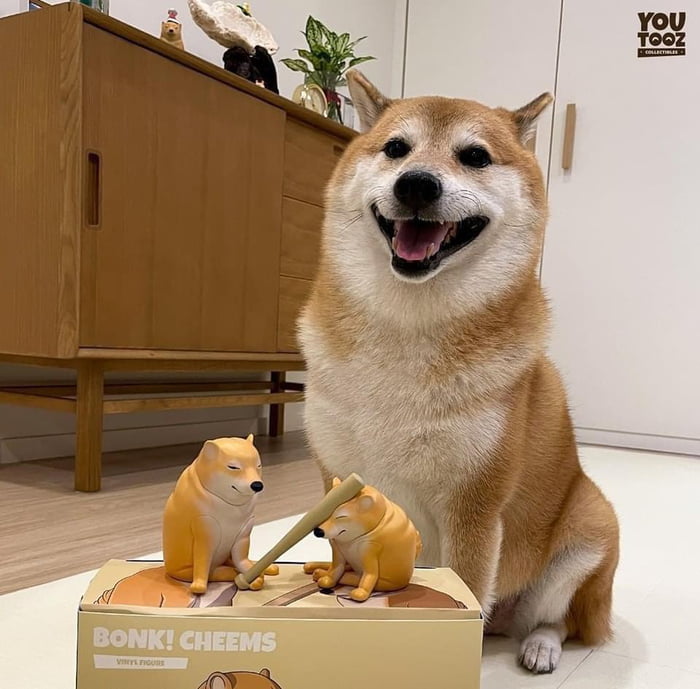
Identify the location of wooden floor. Image resolution: width=700 pixels, height=689 pixels. (96, 520).